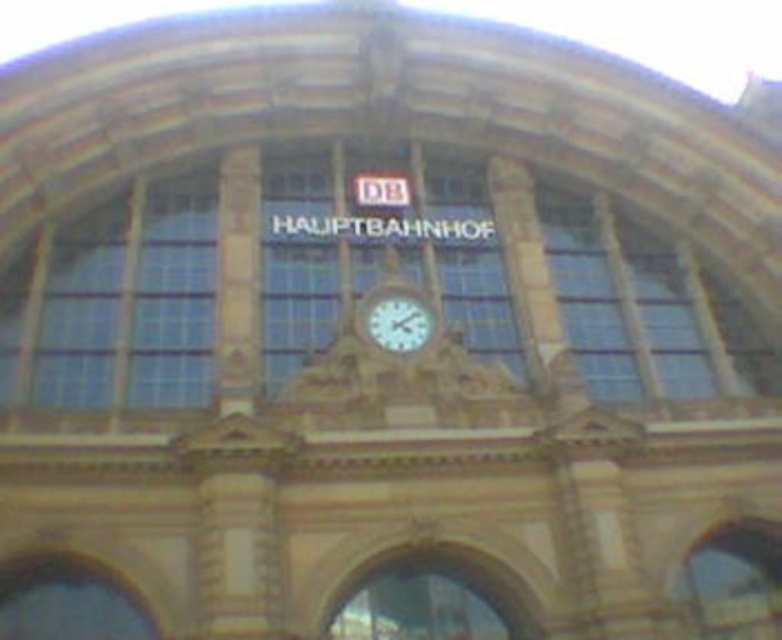
Is clear glass window at center wider than clear glass window at left?

Correct, the width of clear glass window at center exceeds that of clear glass window at left.

What do you see at coordinates (353, 284) in the screenshot? I see `clear glass window at center` at bounding box center [353, 284].

The image size is (782, 640). I want to click on clear glass window at center, so tap(353, 284).

Is clear glass window at left smaller than white glossy clock at center?

No, clear glass window at left is not smaller than white glossy clock at center.

Does clear glass window at left have a lesser width compared to white glossy clock at center?

A: No, clear glass window at left is not thinner than white glossy clock at center.

The image size is (782, 640). What do you see at coordinates (124, 301) in the screenshot?
I see `clear glass window at left` at bounding box center [124, 301].

Identify the location of clear glass window at left. (124, 301).

Is clear glass window at center to the left of white glossy clock at center from the viewer's perspective?

In fact, clear glass window at center is to the right of white glossy clock at center.

Is clear glass window at center positioned at the back of white glossy clock at center?

That is False.

Is point (189, 163) farther from camera compared to point (386, 324)?

That is True.

This screenshot has width=782, height=640. I want to click on clear glass window at center, so click(353, 284).